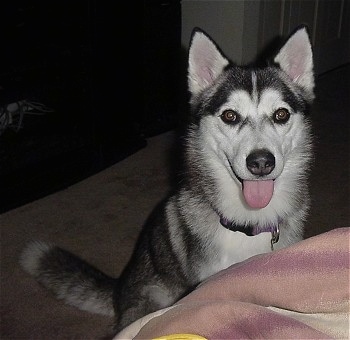
What are the coordinates of `furniture` in the screenshot? It's located at (149, 83).